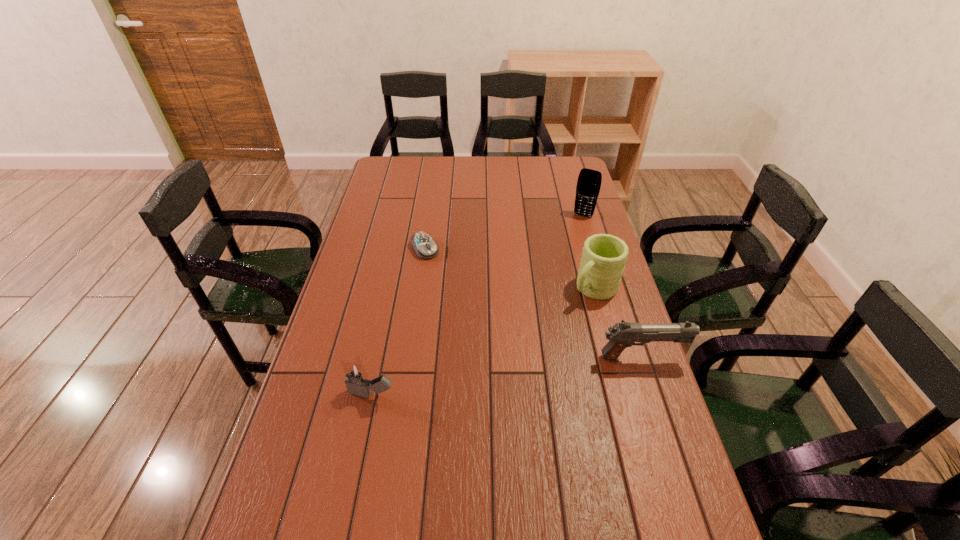
This screenshot has width=960, height=540. I want to click on free space on the desktop that is between the igniter and the second nearest object and is positioned on the wheel side of the second farthest object, so click(514, 375).

You are a GUI agent. You are given a task and a screenshot of the screen. Output one action in this format:
    pyautogui.click(x=<x>, y=<y>)
    Task: Click on the free spot on the desktop that is between the igniter and the fourth farthest object and is positioned on the side of the third farthest object with the handle
    The height and width of the screenshot is (540, 960).
    Given the screenshot: What is the action you would take?
    pyautogui.click(x=499, y=376)

You are a GUI agent. You are given a task and a screenshot of the screen. Output one action in this format:
    pyautogui.click(x=<x>, y=<y>)
    Task: Click on the free space on the desktop that is between the nearest object and the fourth farthest object and is positioned on the screen of the farthest object
    
    Given the screenshot: What is the action you would take?
    pyautogui.click(x=495, y=377)